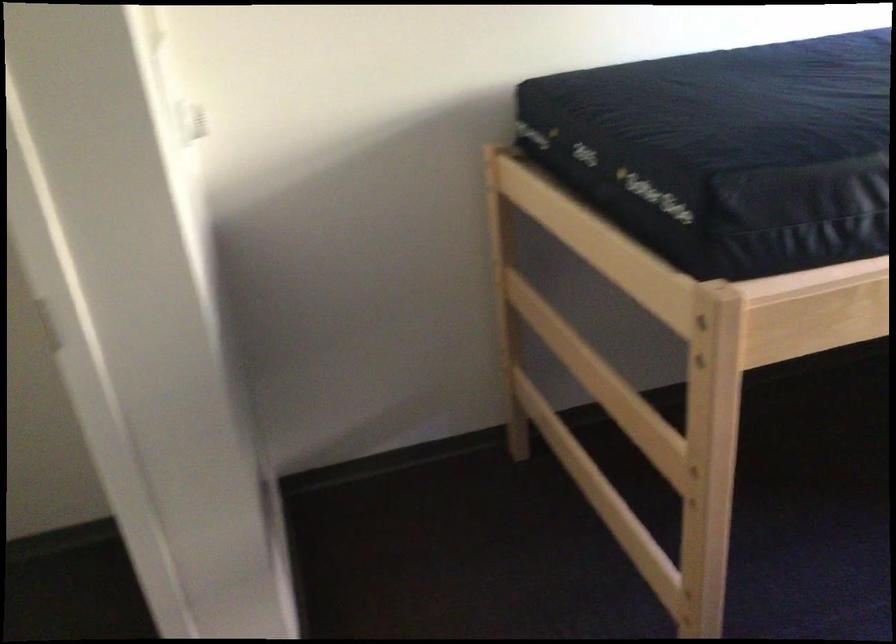
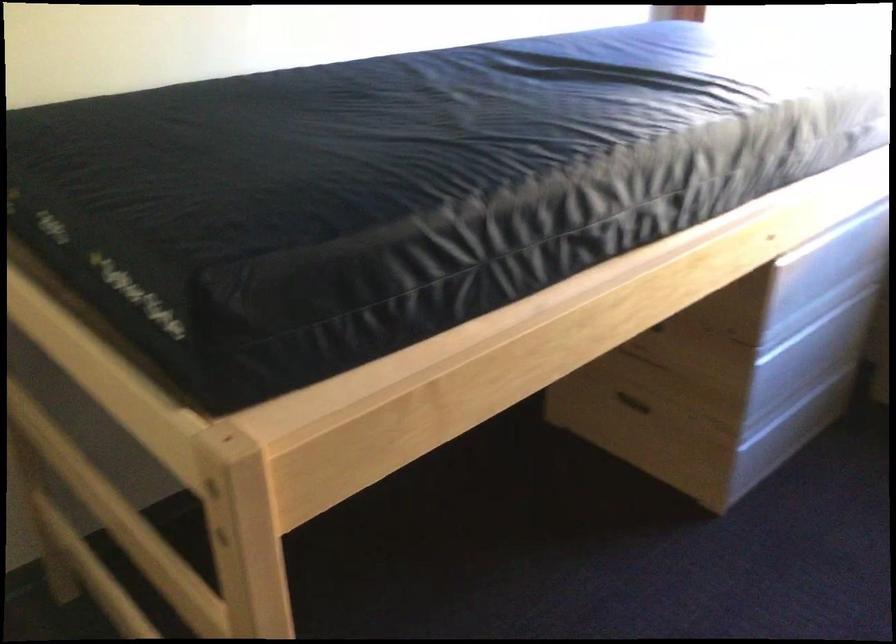
Find the pixel in the second image that matches point 501,453 in the first image.

(44, 608)